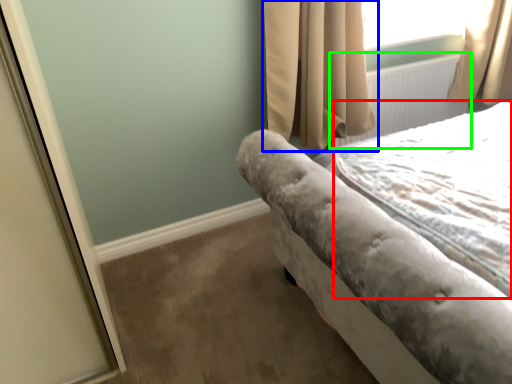
Question: Which object is positioned farthest from sheet (highlighted by a red box)? Select from curtain (highlighted by a blue box) and radiator (highlighted by a green box).

Choices:
 (A) curtain
 (B) radiator

Answer: (B)